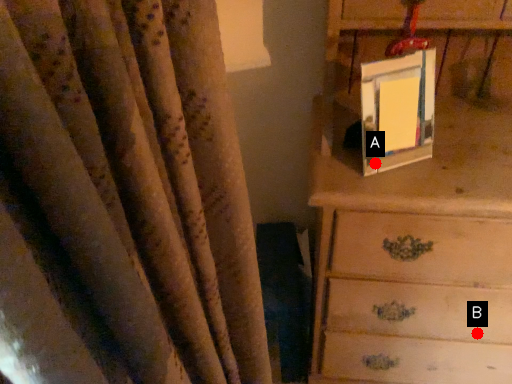
Question: Two points are circled on the image, labeled by A and B beside each circle. Among these points, which one is farthest from the camera?

Choices:
 (A) A is further
 (B) B is further

Answer: (B)